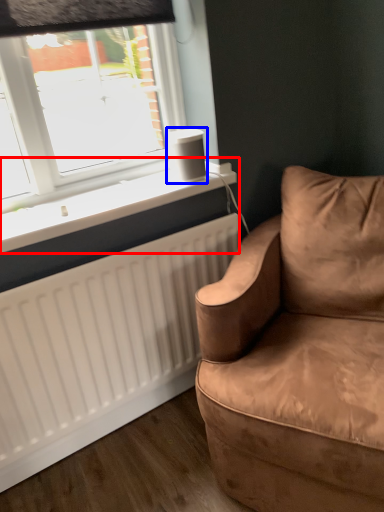
Question: Which object appears closest to the camera in this image, window sill (highlighted by a red box) or speaker (highlighted by a blue box)?

Choices:
 (A) window sill
 (B) speaker

Answer: (A)